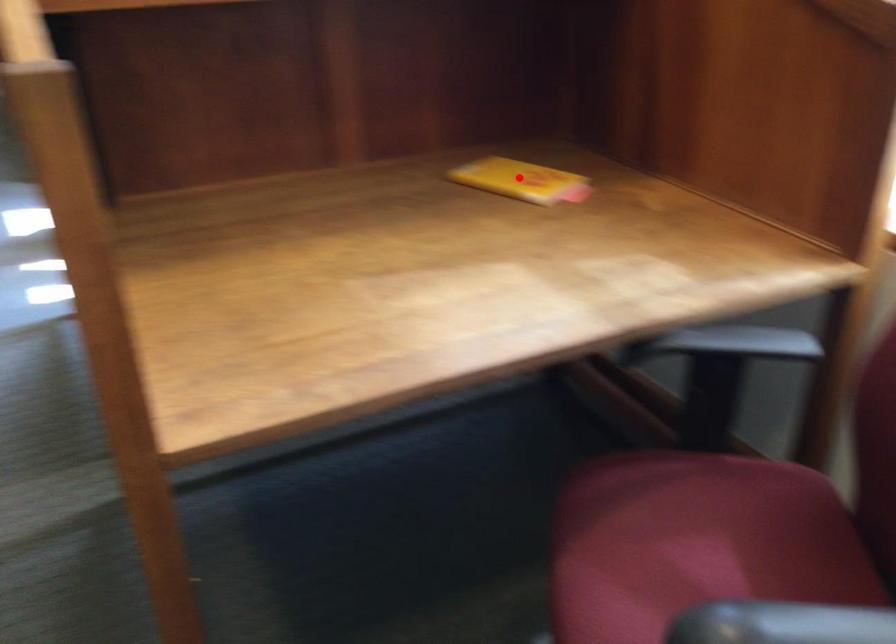
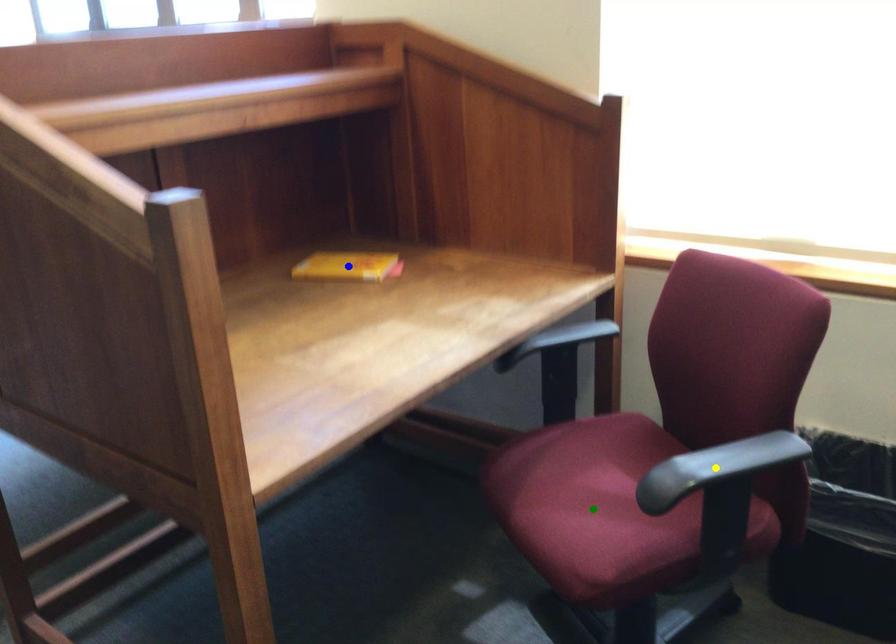
Question: I am providing you with two images of the same scene from different viewpoints. A red point is marked on the first image. You are given multiple points on the second image. Which mark in image 2 goes with the point in image 1?

Choices:
 (A) blue point
 (B) green point
 (C) yellow point

Answer: (A)